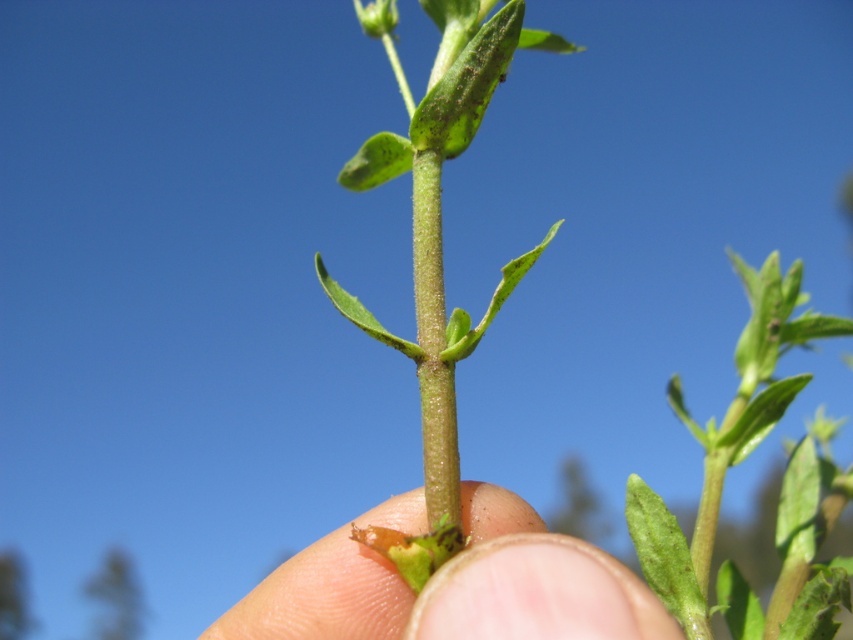
You are holding a plant between two fingers, and you want to know which finger is closer to the camera. The two points representing your fingers are point [410,493] and point [838,582]. Based on their positions, which point is closer to the camera?

Point [838,582] is closer to the camera because it is in front of point [410,493].

You are a botanist examining a plant sample. You notice two features at the center of your viewfinder while photographing the plant. One is the smooth skin at center, and the other is the green matte leaf at center. Which of these two features is shorter in height?

The smooth skin at center has a lesser height compared to the green matte leaf at center, so the smooth skin at center is shorter.

You are a botanist examining a plant specimen. You notice the smooth skin at center and the green matte leaf at center. Which object is nearer to your eyes when observing the plant?

The smooth skin at center is closer to the viewer than the green matte leaf at center, so the smooth skin at center is nearer to your eyes.